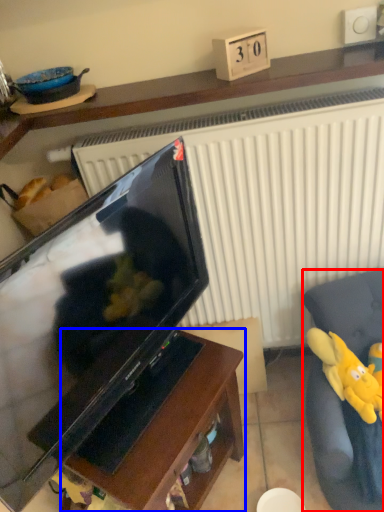
Question: Among these objects, which one is nearest to the camera, furniture (highlighted by a red box) or furniture (highlighted by a blue box)?

Choices:
 (A) furniture
 (B) furniture

Answer: (A)